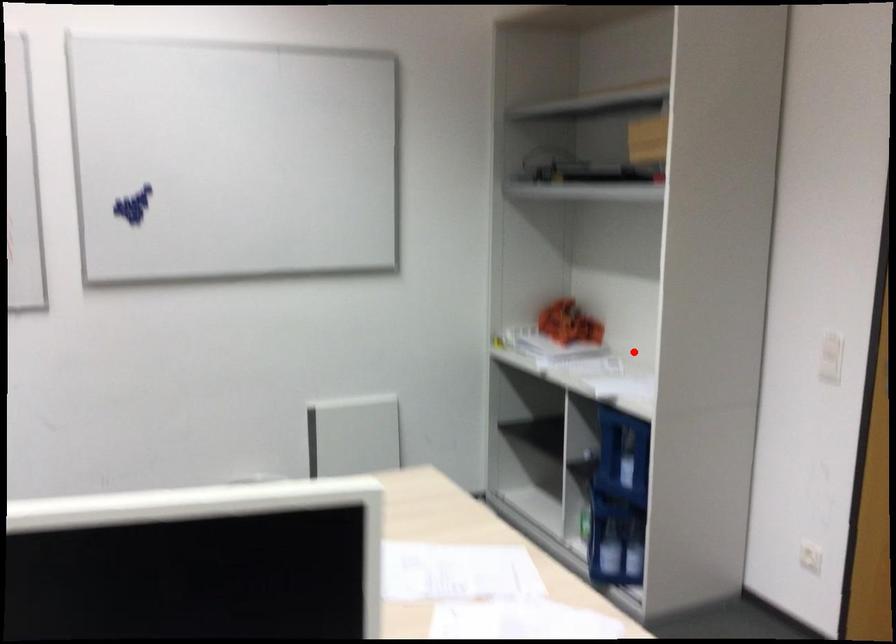
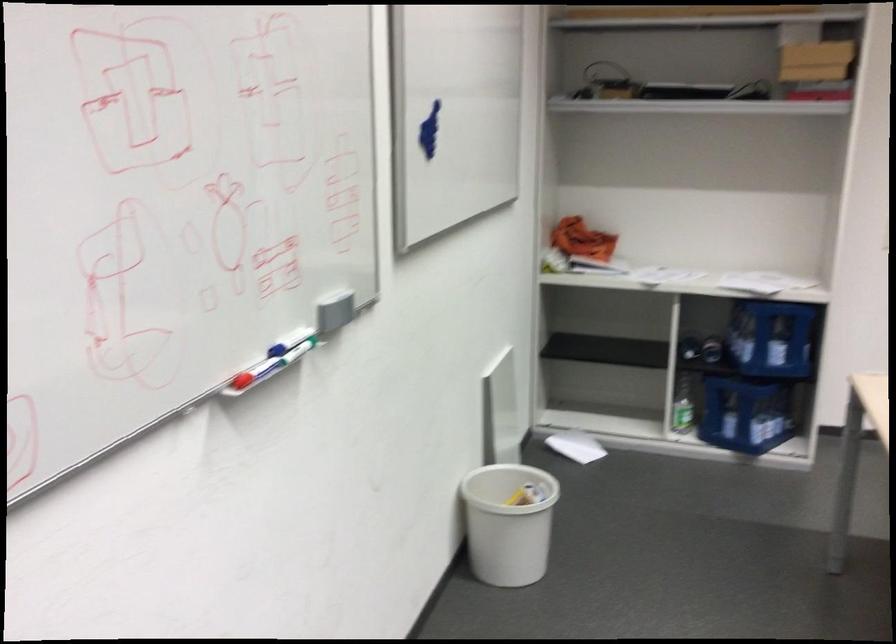
The point at the highlighted location is marked in the first image. Where is the corresponding point in the second image?

(660, 275)